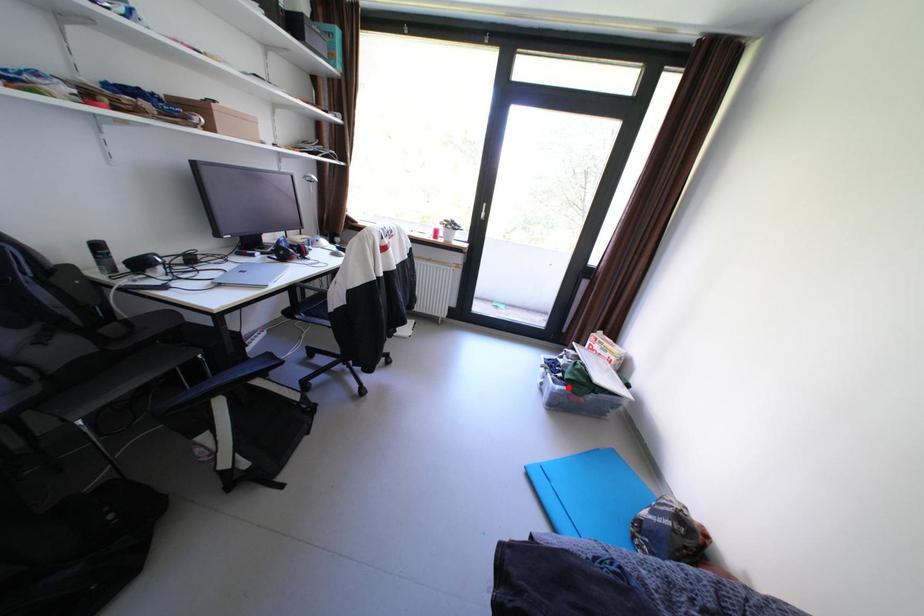
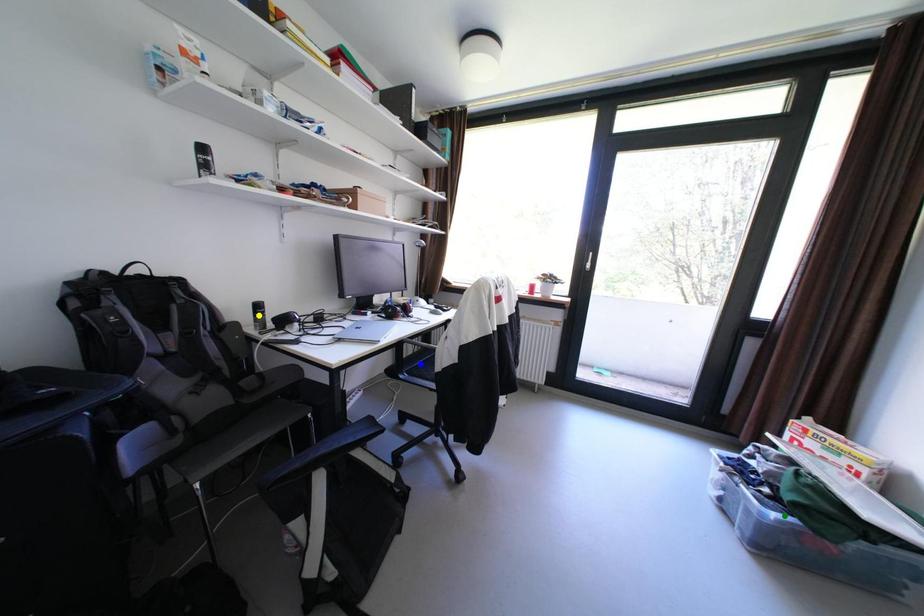
Question: I am providing you with two images of the same scene from different viewpoints. A red point is marked on the first image. You are given multiple points on the second image. Which mark in image 2 goes with the point in image 1?

Choices:
 (A) yellow point
 (B) blue point
 (C) green point

Answer: (C)